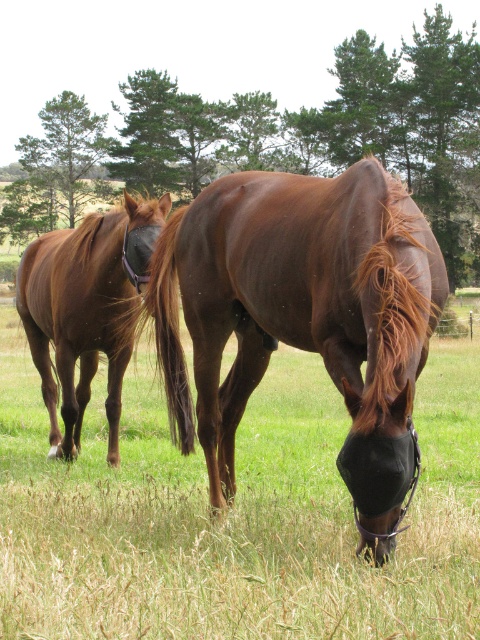
Question: Does brown leather horse at center come in front of brown glossy horse at left?

Choices:
 (A) no
 (B) yes

Answer: (B)

Question: Which point is farther to the camera?

Choices:
 (A) brown glossy horse at center
 (B) brown leather horse at center
 (C) brown glossy horse at left

Answer: (C)

Question: Which point is closer to the camera?

Choices:
 (A) click(140, 227)
 (B) click(301, 394)
 (C) click(196, 218)

Answer: (C)

Question: Among these objects, which one is nearest to the camera?

Choices:
 (A) brown glossy horse at left
 (B) brown glossy horse at center
 (C) brown leather horse at center

Answer: (C)

Question: Considering the relative positions of brown leather horse at center and brown glossy horse at center in the image provided, where is brown leather horse at center located with respect to brown glossy horse at center?

Choices:
 (A) left
 (B) right

Answer: (A)

Question: Is brown leather horse at center closer to the viewer compared to brown glossy horse at center?

Choices:
 (A) no
 (B) yes

Answer: (B)